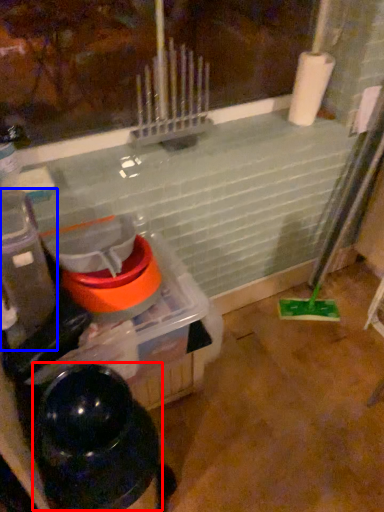
Question: Which point is closer to the camera, water heater (highlighted by a red box) or appliance (highlighted by a blue box)?

Choices:
 (A) water heater
 (B) appliance

Answer: (A)